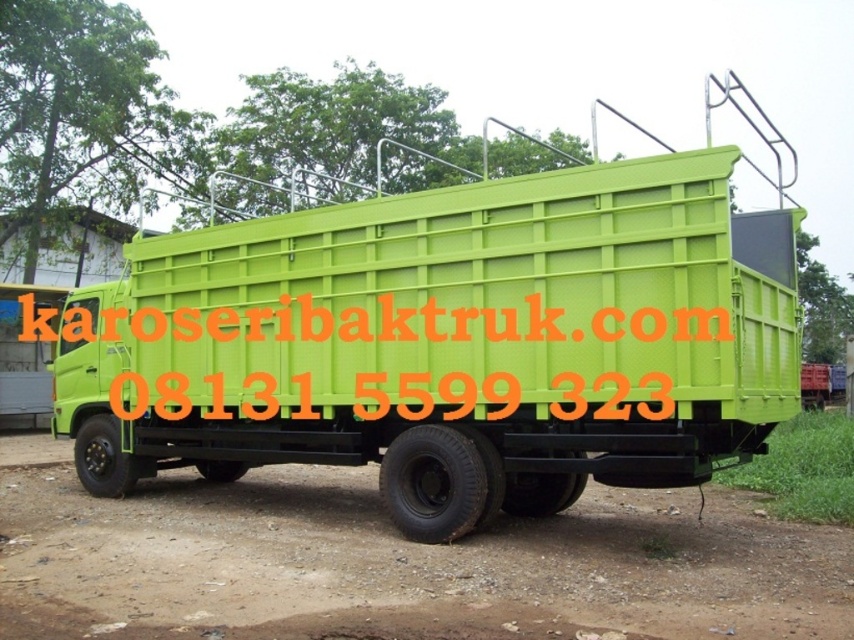
Is point (548, 461) farther from camera compared to point (489, 536)?

That is False.

Looking at this image, who is lower down, green plastic container at center or brown dirt track at lower center?

Positioned lower is brown dirt track at lower center.

Which is in front, point (576, 220) or point (715, 490)?

Point (576, 220)

The width and height of the screenshot is (854, 640). I want to click on green plastic container at center, so click(x=449, y=342).

Is green plastic container at center to the left of green plastic text at center from the viewer's perspective?

In fact, green plastic container at center is to the right of green plastic text at center.

Is point (551, 497) behind point (237, 336)?

That is False.

Does point (681, 426) come in front of point (256, 355)?

Yes, point (681, 426) is in front of point (256, 355).

Find the location of a particular element. green plastic container at center is located at coordinates (449, 342).

Is brown dirt track at lower center taller than green plastic text at center?

Incorrect, brown dirt track at lower center's height is not larger of green plastic text at center's.

Who is higher up, brown dirt track at lower center or green plastic text at center?

green plastic text at center is above.

The width and height of the screenshot is (854, 640). Find the location of `brown dirt track at lower center`. brown dirt track at lower center is located at coordinates (417, 561).